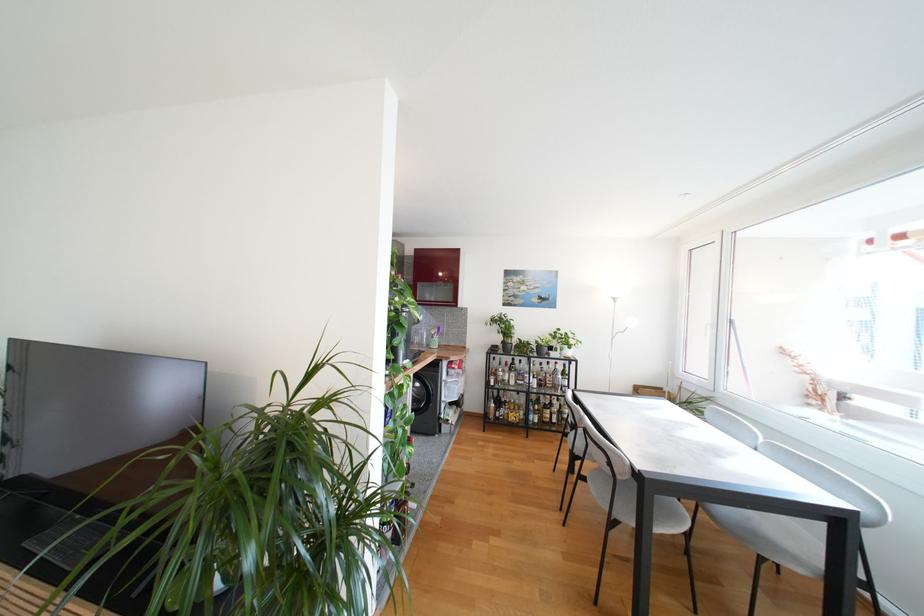
What do you see at coordinates (707, 330) in the screenshot? This screenshot has height=616, width=924. I see `a white window handle` at bounding box center [707, 330].